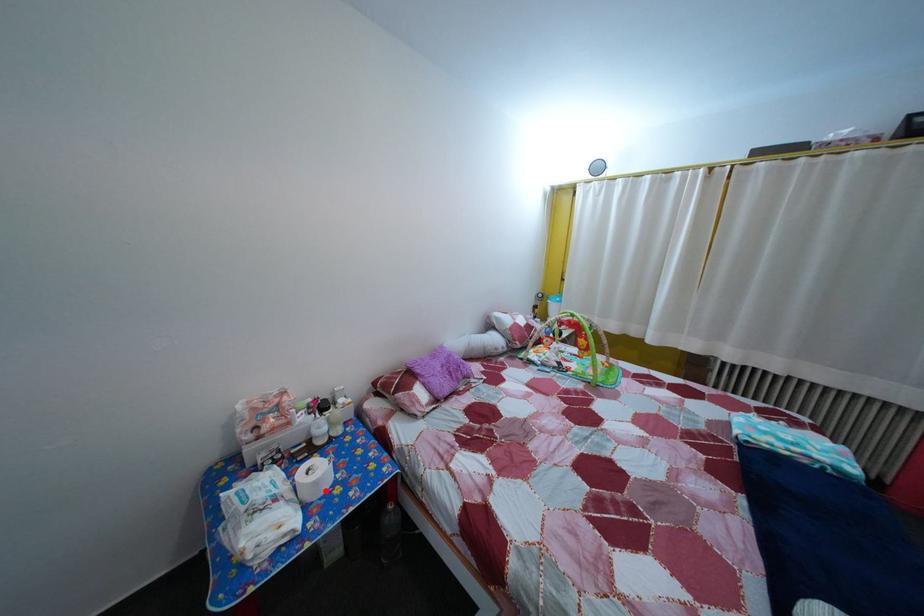
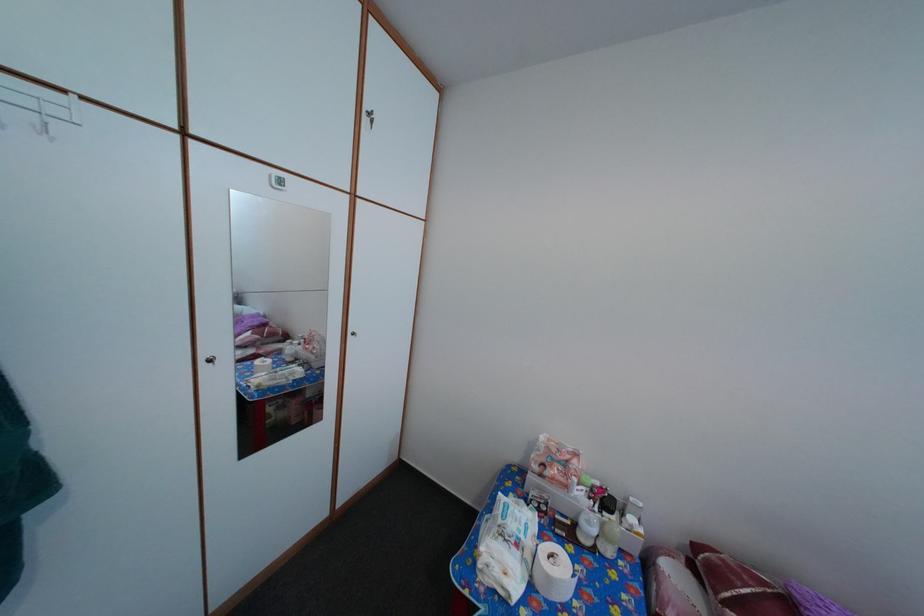
Question: A red point is marked in image1. In image2, is the corresponding 3D point closer to the camera or farther? Reply with the corresponding letter.

Choices:
 (A) The corresponding 3D point is closer.
 (B) The corresponding 3D point is farther.

Answer: (B)